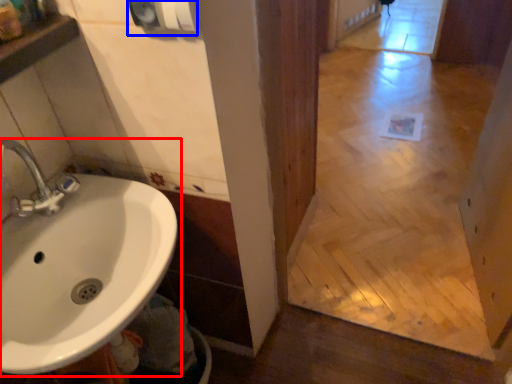
Question: Which object appears farthest to the camera in this image, sink (highlighted by a red box) or hand dryer (highlighted by a blue box)?

Choices:
 (A) sink
 (B) hand dryer

Answer: (B)